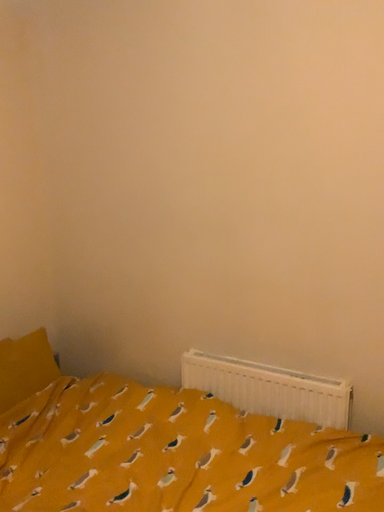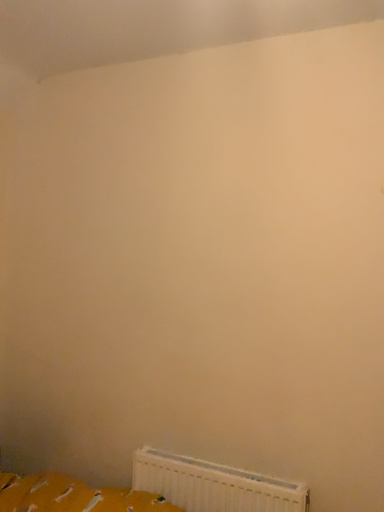
Question: How did the camera likely rotate when shooting the video?

Choices:
 (A) rotated upward
 (B) rotated downward

Answer: (A)